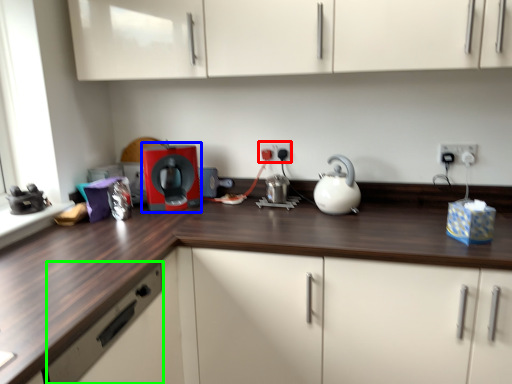
Question: Based on their relative distances, which object is nearer to electric outlet (highlighted by a red box)? Choose from home appliance (highlighted by a blue box) and drawer (highlighted by a green box).

Choices:
 (A) home appliance
 (B) drawer

Answer: (A)